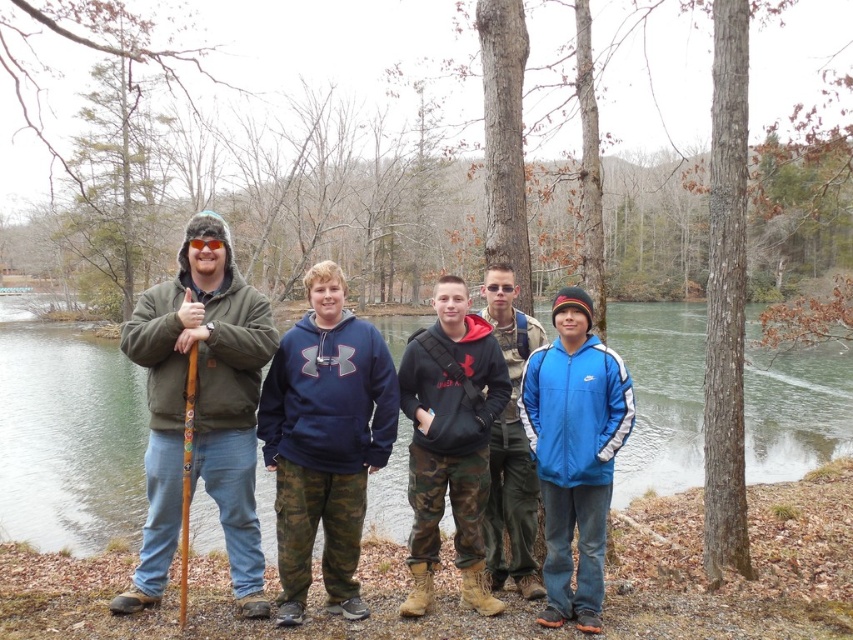
Question: Among these objects, which one is farthest from the camera?

Choices:
 (A) greenish water at center
 (B) navy blue fleece at center

Answer: (A)

Question: Estimate the real-world distances between objects in this image. Which object is farther from the navy blue fleece at center?

Choices:
 (A) camouflage pants at center
 (B) camo pants at center

Answer: (A)

Question: Which point is closer to the camera?

Choices:
 (A) (474, 429)
 (B) (548, 621)
 (C) (518, 560)
 (D) (325, 406)

Answer: (D)

Question: Is greenish water at center further to the viewer compared to camouflage pants at center?

Choices:
 (A) no
 (B) yes

Answer: (A)

Question: Is navy blue fleece at center positioned behind camo pants at center?

Choices:
 (A) yes
 (B) no

Answer: (B)

Question: Can you confirm if green matte jacket at left is thinner than navy blue fleece at center?

Choices:
 (A) no
 (B) yes

Answer: (B)